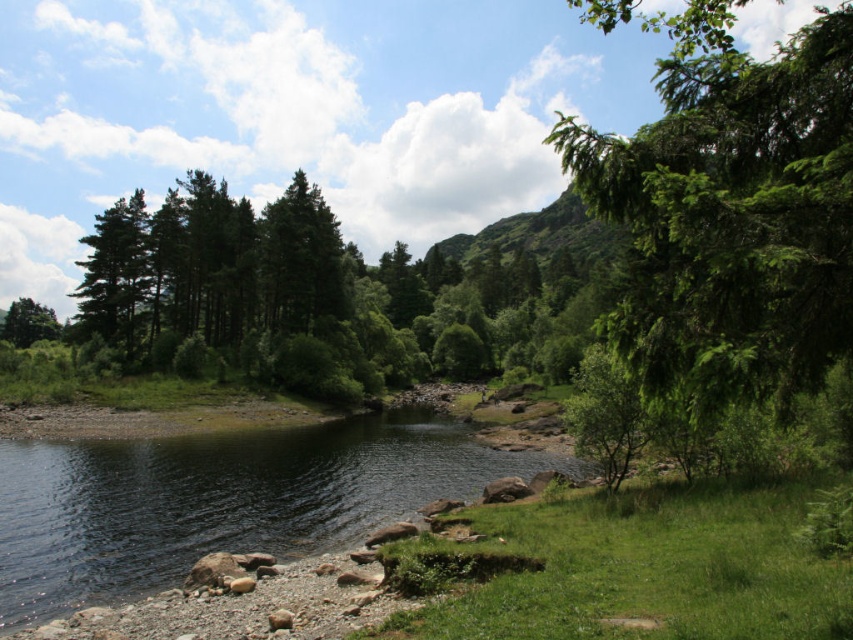
You are a hiker standing at the center of the valley looking towards the dense cluster of trees on the left. You want to take a photo that includes both the green leafy tree at right and the green grassy river at lower left. Which object should you position closer to the edge of the frame to ensure both are visible?

You should position the green grassy river at lower left closer to the edge of the frame since the green leafy tree at right is much taller and will occupy more vertical space, allowing both to fit within the photo.

You are standing at the center of the image and want to walk towards the green leafy tree at right. Which direction should you go to avoid the green matte tree at left?

The green leafy tree at right is positioned over the green matte tree at left, so you should walk towards the right to avoid the green matte tree at left.